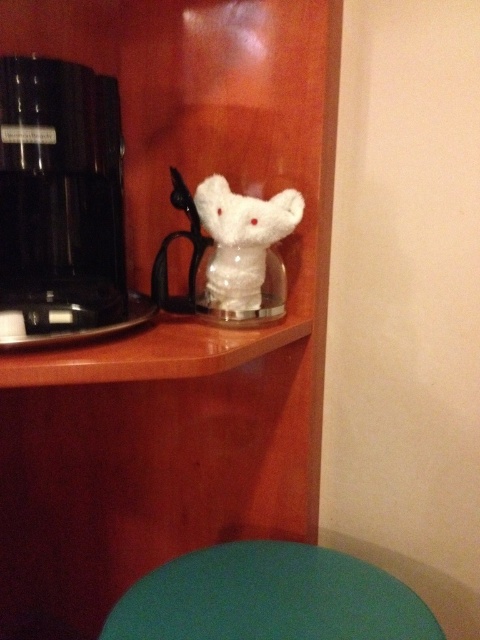
Who is lower down, white plush toy at center or teal matte table at lower center?

teal matte table at lower center is below.

Is white plush toy at center to the left of teal matte table at lower center from the viewer's perspective?

Yes, white plush toy at center is to the left of teal matte table at lower center.

The image size is (480, 640). What do you see at coordinates (175, 316) in the screenshot?
I see `white plush toy at center` at bounding box center [175, 316].

You are a GUI agent. You are given a task and a screenshot of the screen. Output one action in this format:
    pyautogui.click(x=<x>, y=<y>)
    Task: Click on the white plush toy at center
    The width and height of the screenshot is (480, 640).
    Given the screenshot: What is the action you would take?
    pyautogui.click(x=175, y=316)

Who is taller, black plastic coffee machine at left or teal matte table at lower center?

With more height is black plastic coffee machine at left.

Describe the element at coordinates (61, 205) in the screenshot. I see `black plastic coffee machine at left` at that location.

Is point (45, 84) farther from viewer compared to point (292, 579)?

That is False.

I want to click on black plastic coffee machine at left, so pos(61,205).

Measure the distance between white plush toy at center and white fluffy elephant at center.

A distance of 8.35 inches exists between white plush toy at center and white fluffy elephant at center.

Find the location of `white plush toy at center`. white plush toy at center is located at coordinates (175, 316).

Is point (248, 385) positioned before point (217, 189)?

No, it is not.

I want to click on white plush toy at center, so click(x=175, y=316).